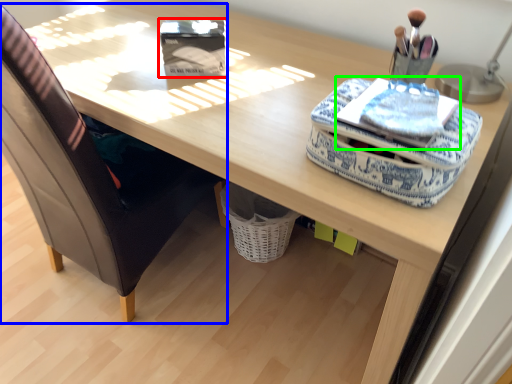
Question: Which object is positioned closest to storage box (highlighted by a red box)? Select from chair (highlighted by a blue box) and notepad (highlighted by a green box).

Choices:
 (A) chair
 (B) notepad

Answer: (B)